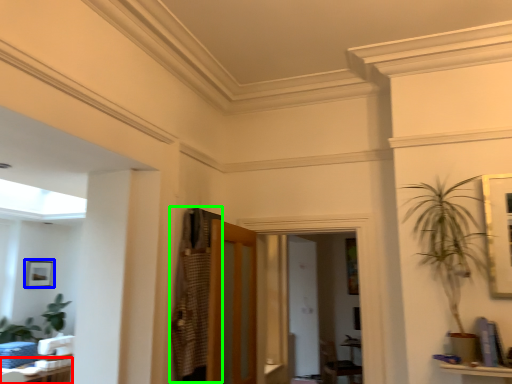
Question: Considering the real-world distances, which object is closest to table (highlighted by a red box)? picture frame (highlighted by a blue box) or armoire (highlighted by a green box).

Choices:
 (A) picture frame
 (B) armoire

Answer: (B)